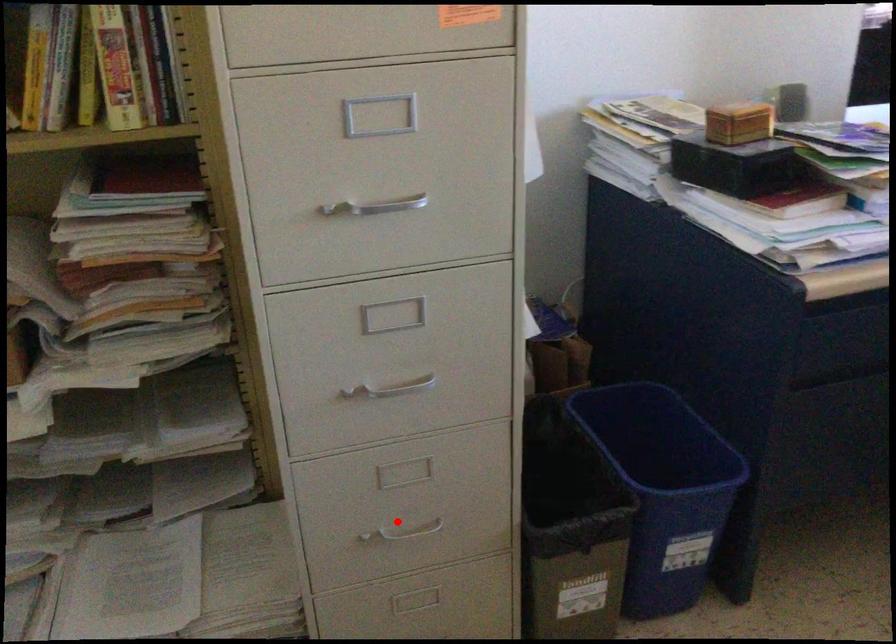
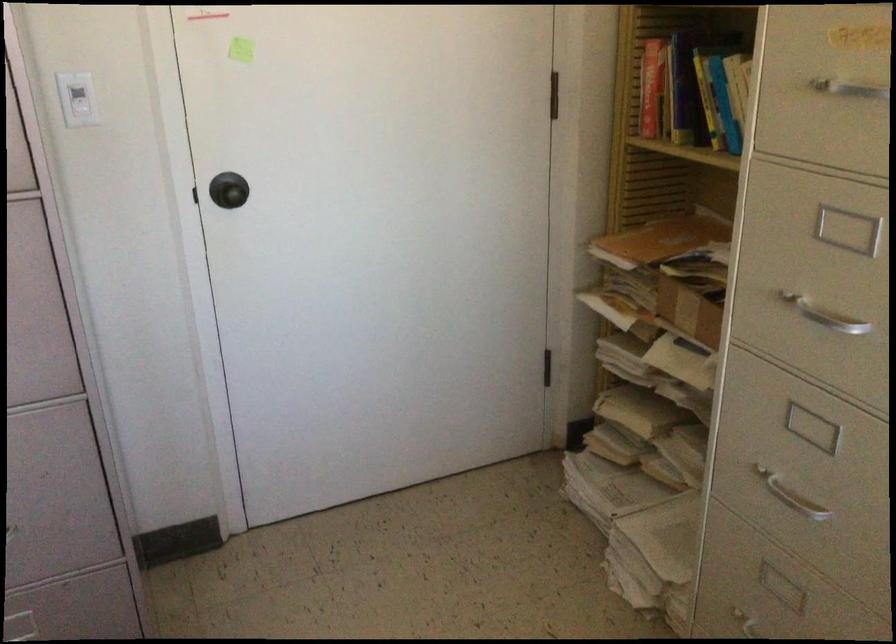
The point at the highlighted location is marked in the first image. Where is the corresponding point in the second image?

(754, 625)